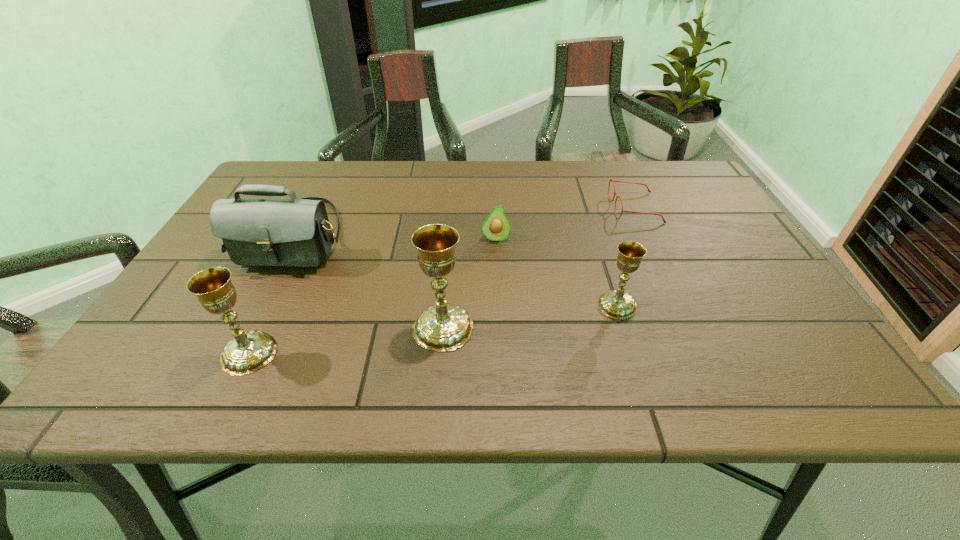
Locate an element on the screen. empty space that is in between the rightmost chalice and the second chalice from right to left is located at coordinates tap(530, 316).

This screenshot has height=540, width=960. I want to click on unoccupied area between the shoulder bag and the tallest chalice, so click(369, 282).

Find the location of a particular element. Image resolution: width=960 pixels, height=540 pixels. free space that is in between the rightmost object and the second chalice from right to left is located at coordinates (539, 268).

This screenshot has width=960, height=540. What are the coordinates of `vacant space in between the shoulder bag and the rightmost object` in the screenshot? It's located at (465, 222).

Choose which object is the second nearest neighbor to the second chalice from right to left. Please provide its 2D coordinates. Your answer should be formatted as a tuple, i.e. [(x, y)], where the tuple contains the x and y coordinates of a point satisfying the conditions above.

[(296, 232)]

Locate which object is the closest to the third object from right to left. Please provide its 2D coordinates. Your answer should be formatted as a tuple, i.e. [(x, y)], where the tuple contains the x and y coordinates of a point satisfying the conditions above.

[(444, 327)]

Locate an element on the screen. The height and width of the screenshot is (540, 960). chalice that is the second nearest to the fourth tallest object is located at coordinates (248, 352).

Choose which chalice is the nearest neighbor to the second shortest chalice. Please provide its 2D coordinates. Your answer should be formatted as a tuple, i.e. [(x, y)], where the tuple contains the x and y coordinates of a point satisfying the conditions above.

[(444, 327)]

At what (x,y) coordinates should I click in order to perform the action: click on vacant space that satisfies the following two spatial constraints: 1. on the face of the rightmost object; 2. on the cut side of the third object from right to left. Please return your answer as a coordinate pair (x, y). Image resolution: width=960 pixels, height=540 pixels. Looking at the image, I should click on (650, 239).

The image size is (960, 540). I want to click on free spot that satisfies the following two spatial constraints: 1. on the face of the spectacles; 2. on the front side of the shoulder bag, so click(x=648, y=236).